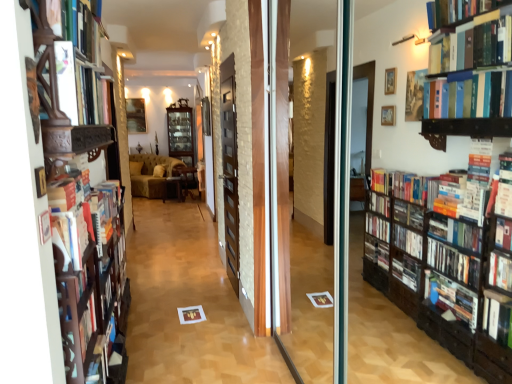
Find the location of a particular element. spots to the right of matte brown paper at center is located at coordinates (221, 314).